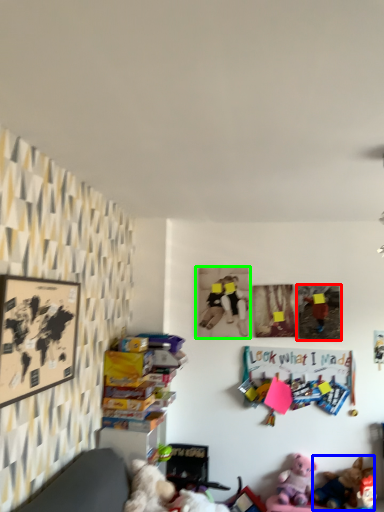
Question: Estimate the real-world distances between objects in this image. Which object is farther from picture frame (highlighted by a red box), toy (highlighted by a blue box) or picture frame (highlighted by a green box)?

Choices:
 (A) toy
 (B) picture frame

Answer: (A)